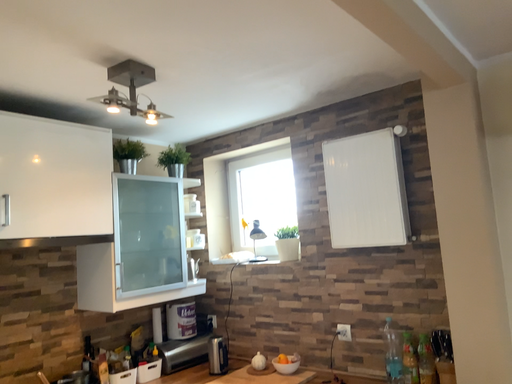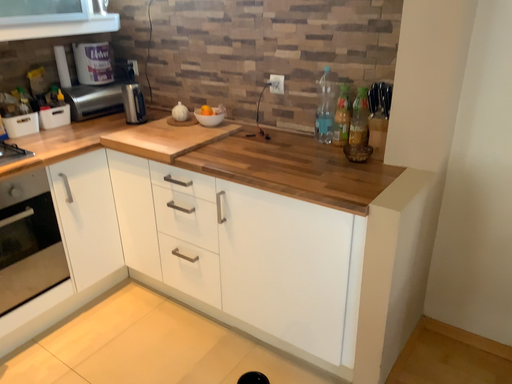
Question: How did the camera likely rotate when shooting the video?

Choices:
 (A) rotated downward
 (B) rotated upward

Answer: (A)